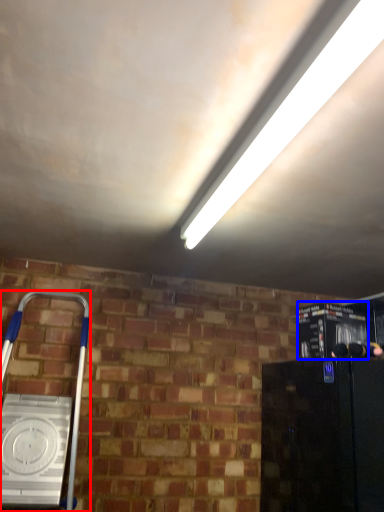
Question: Among these objects, which one is farthest to the camera, home appliance (highlighted by a red box) or appliance (highlighted by a blue box)?

Choices:
 (A) home appliance
 (B) appliance

Answer: (B)